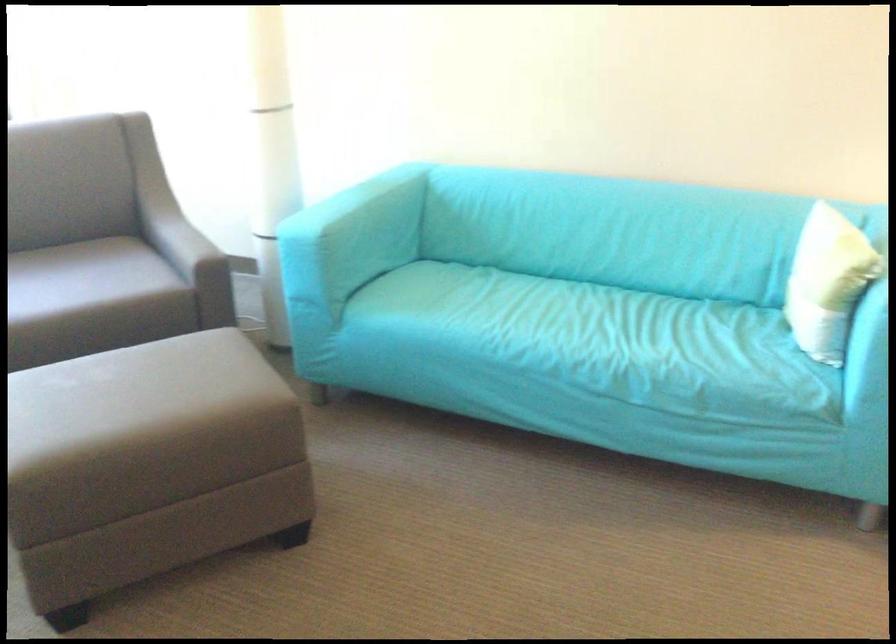
Where is `sofa sitting surface`? sofa sitting surface is located at coordinates (556, 328).